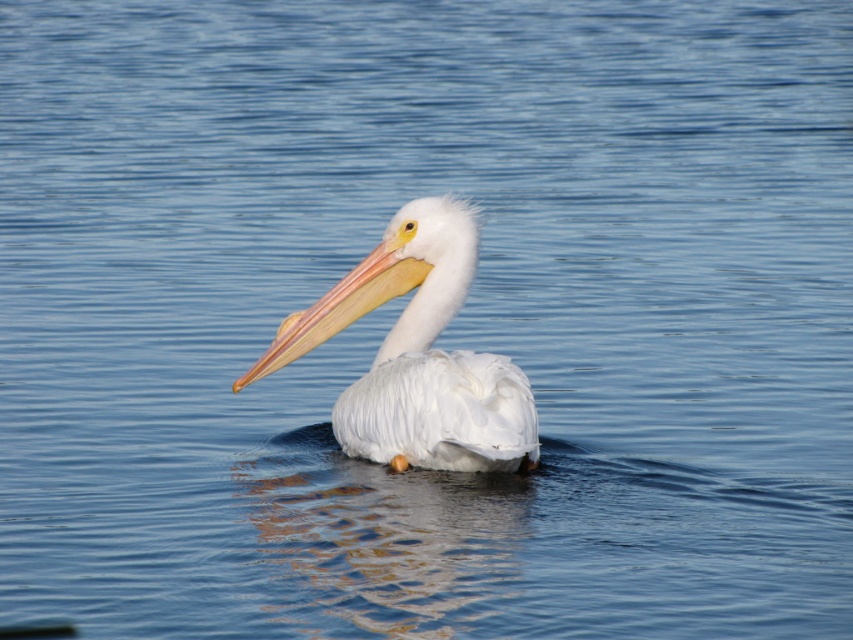
Question: Is white feathered pelican at center to the left of matte orange beak at center from the viewer's perspective?

Choices:
 (A) no
 (B) yes

Answer: (A)

Question: Does white feathered pelican at center appear on the right side of matte orange beak at center?

Choices:
 (A) no
 (B) yes

Answer: (B)

Question: Is white feathered pelican at center in front of matte orange beak at center?

Choices:
 (A) no
 (B) yes

Answer: (B)

Question: Which point is closer to the camera taking this photo?

Choices:
 (A) (381, 435)
 (B) (321, 298)

Answer: (A)

Question: Which of the following is the closest to the observer?

Choices:
 (A) (361, 445)
 (B) (374, 282)

Answer: (A)